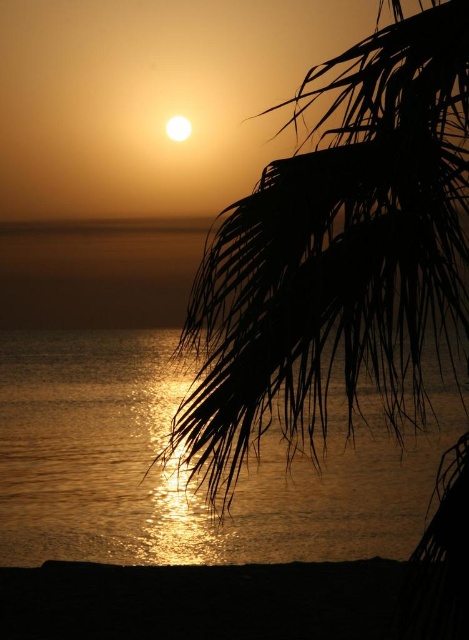
Which of these two, silhouette leafy branch at upper right or glistening water at center, stands taller?

silhouette leafy branch at upper right is taller.

Does point (295, 300) come in front of point (135, 493)?

That is True.

Between point (304, 273) and point (249, 524), which one is positioned behind?

Point (249, 524)

At what (x,y) coordinates should I click in order to perform the action: click on silhouette leafy branch at upper right. Please return your answer as a coordinate pair (x, y). Image resolution: width=469 pixels, height=640 pixels. Looking at the image, I should click on (339, 253).